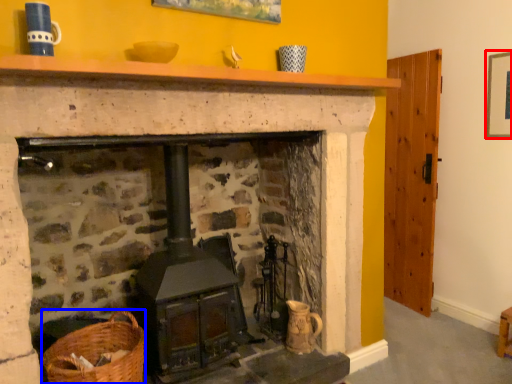
Question: Which of the following is the closest to the observer, picture frame (highlighted by a red box) or basket (highlighted by a blue box)?

Choices:
 (A) picture frame
 (B) basket

Answer: (B)